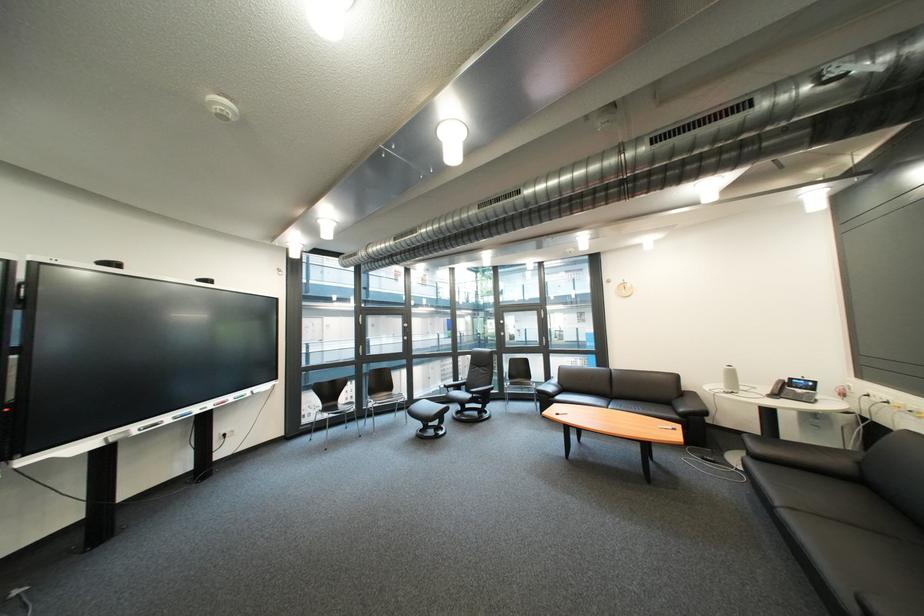
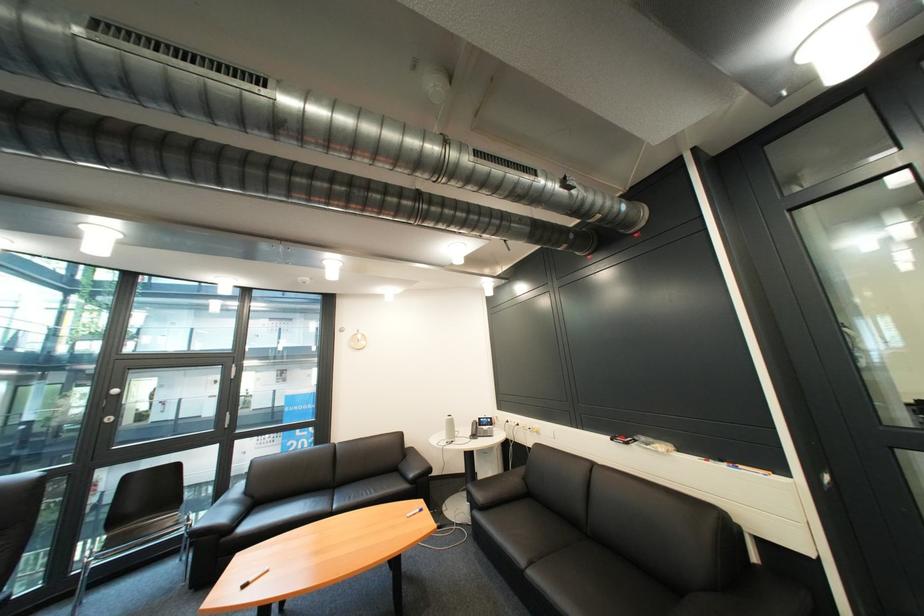
Find the pixel in the second image that matches the point at 800,516 in the first image.

(546, 577)